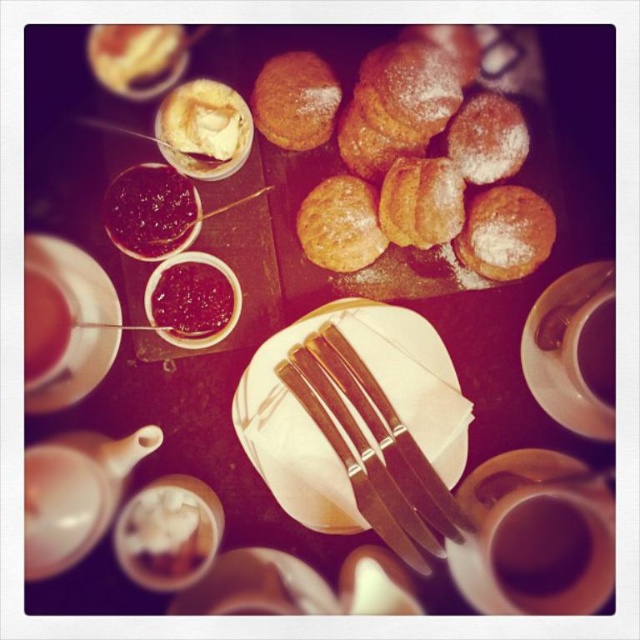
Can you confirm if white porcelain saucer at upper left is positioned below brown matte cup at lower right?

Actually, white porcelain saucer at upper left is above brown matte cup at lower right.

Can you confirm if white porcelain saucer at upper left is smaller than brown matte cup at lower right?

Incorrect, white porcelain saucer at upper left is not smaller in size than brown matte cup at lower right.

Is point (77, 340) closer to viewer compared to point (502, 566)?

Yes.

Locate an element on the screen. The width and height of the screenshot is (640, 640). white porcelain saucer at upper left is located at coordinates (74, 276).

Can you confirm if powdery golden pastries at center is smaller than white paper plate at center?

No, powdery golden pastries at center is not smaller than white paper plate at center.

This screenshot has height=640, width=640. In order to click on powdery golden pastries at center in this screenshot , I will do `click(410, 156)`.

Where is `powdery golden pastries at center`? The image size is (640, 640). powdery golden pastries at center is located at coordinates (410, 156).

Which is more to the left, white paper plate at center or matte white cup at lower left?

→ matte white cup at lower left

Is point (352, 410) farther from camera compared to point (40, 288)?

Yes, point (352, 410) is behind point (40, 288).

Is point (384, 330) positioned after point (49, 280)?

Yes, it is.

Where is `white paper plate at center`? This screenshot has width=640, height=640. white paper plate at center is located at coordinates (317, 426).